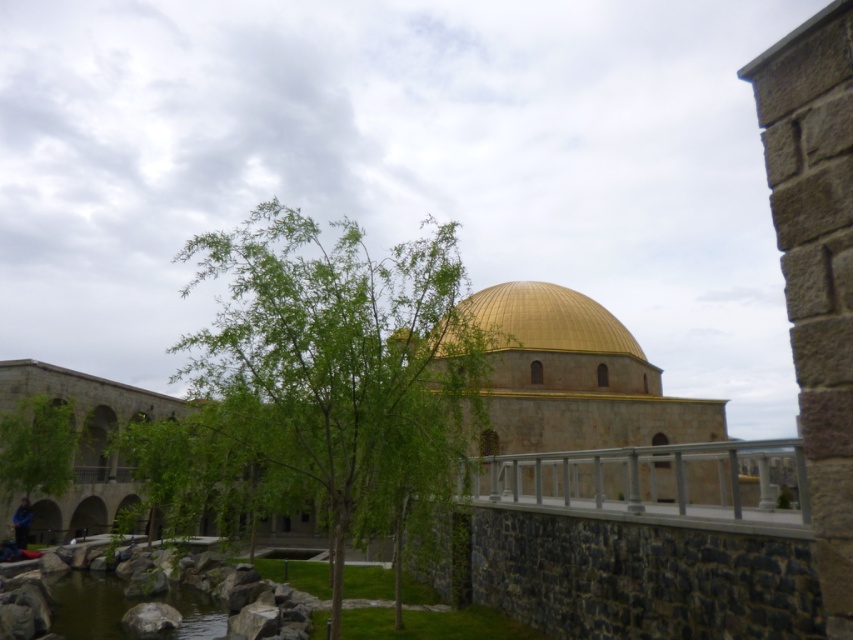
Looking at this image, is green leafy tree at center closer to camera compared to blue fabric jacket at lower left?

Yes, it is.

Is point (422, 248) positioned after point (20, 531)?

No.

Where is `green leafy tree at center`? The height and width of the screenshot is (640, 853). green leafy tree at center is located at coordinates (328, 376).

Is green leafy tree at lower left closer to the viewer compared to blue fabric jacket at lower left?

No, it is not.

Does green leafy tree at lower left have a lesser width compared to blue fabric jacket at lower left?

Yes.

At what (x,y) coordinates should I click in order to perform the action: click on green leafy tree at lower left. Please return your answer as a coordinate pair (x, y). The image size is (853, 640). Looking at the image, I should click on (36, 445).

How distant is green water at lower left from green leafy tree at lower left?

green water at lower left is 30.47 feet away from green leafy tree at lower left.

Which of these two, green water at lower left or green leafy tree at lower left, stands shorter?

Standing shorter between the two is green leafy tree at lower left.

Locate an element on the screen. This screenshot has height=640, width=853. green water at lower left is located at coordinates click(125, 608).